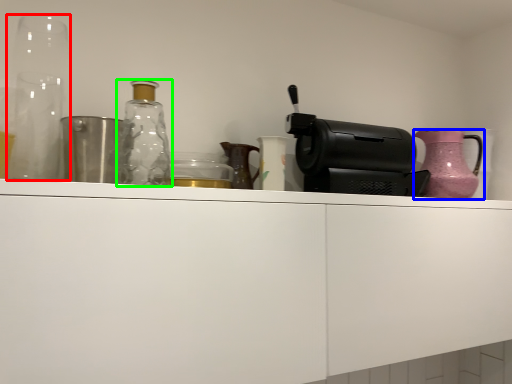
Question: Which object is positioned farthest from glass vase (highlighted by a red box)? Select from jug (highlighted by a blue box) and bottle (highlighted by a green box).

Choices:
 (A) jug
 (B) bottle

Answer: (A)